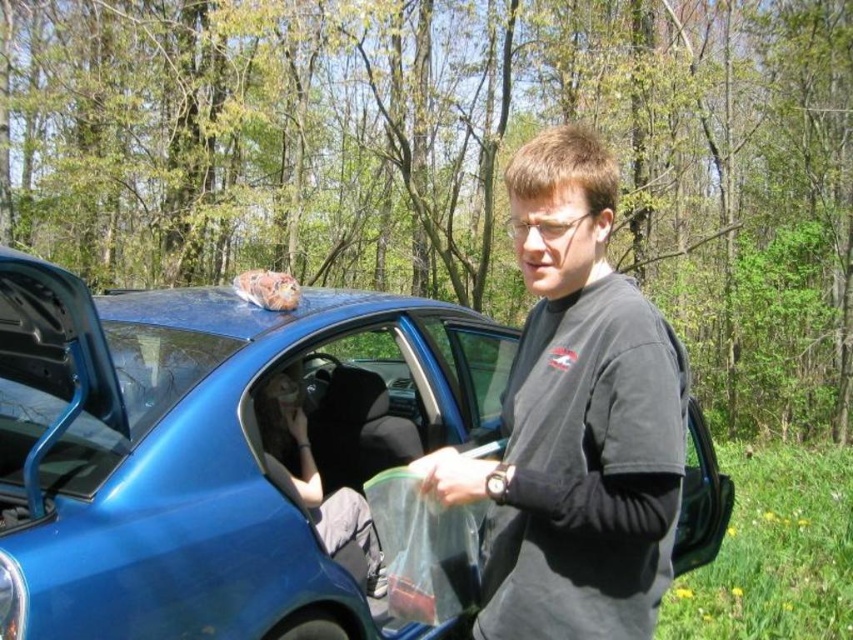
Can you confirm if blue metallic car at center is positioned below black matte shirt at center?

Yes.

The width and height of the screenshot is (853, 640). What do you see at coordinates (210, 451) in the screenshot?
I see `blue metallic car at center` at bounding box center [210, 451].

Find the location of a particular element. blue metallic car at center is located at coordinates (210, 451).